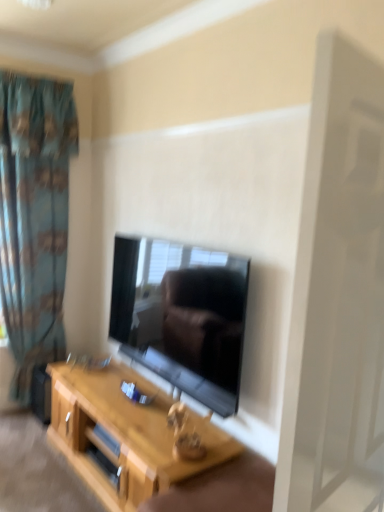
Question: Considering the positions of blue fabric curtain at left and black glossy tv at center in the image, is blue fabric curtain at left wider or thinner than black glossy tv at center?

Choices:
 (A) wide
 (B) thin

Answer: (A)

Question: From a real-world perspective, is blue fabric curtain at left physically located above or below black glossy tv at center?

Choices:
 (A) above
 (B) below

Answer: (A)

Question: Which object is the closest to the blue fabric curtain at left?

Choices:
 (A) light wood table at center
 (B) black glossy tv at center
 (C) white matte screen door at upper right

Answer: (B)

Question: Which is nearer to the light wood table at center?

Choices:
 (A) blue fabric curtain at left
 (B) white matte screen door at upper right
 (C) black glossy tv at center

Answer: (C)